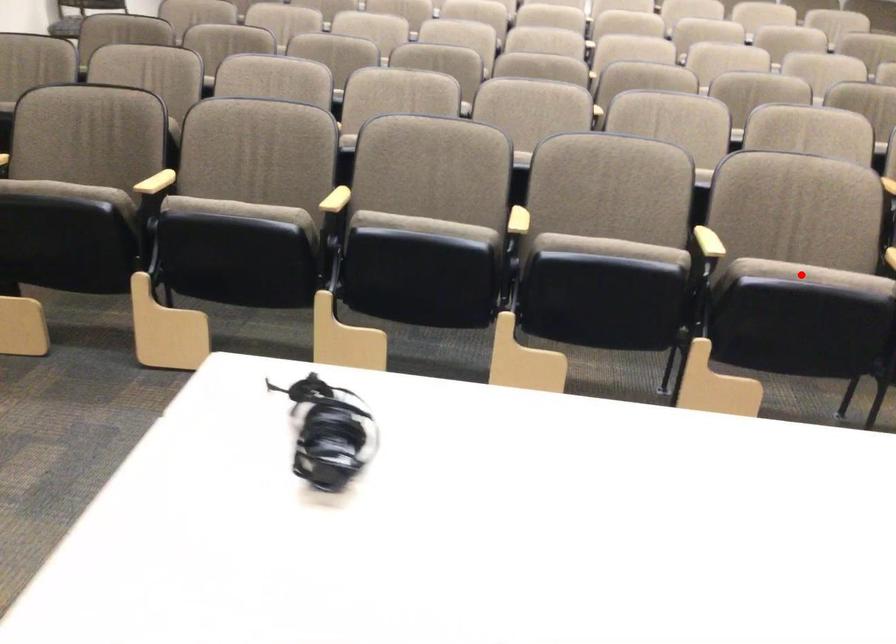
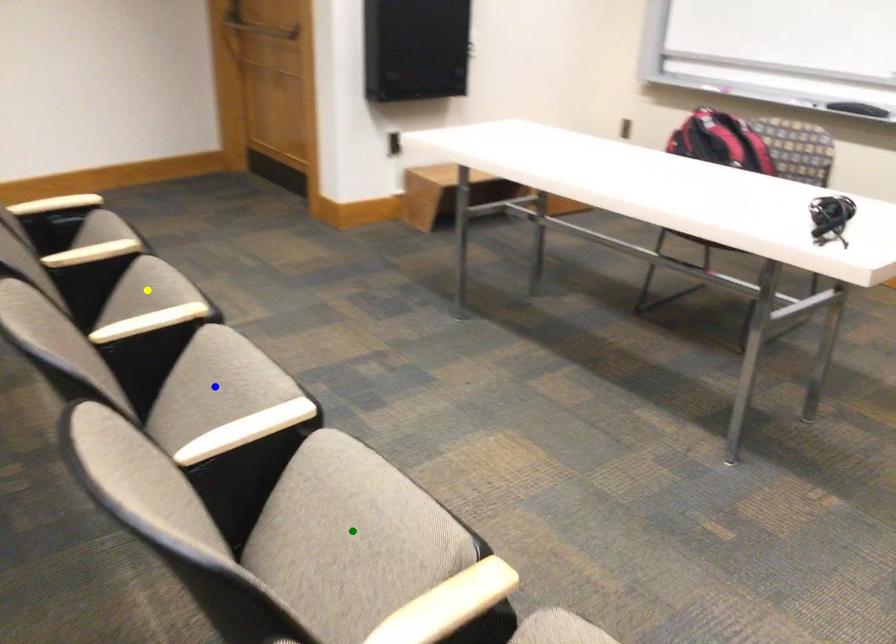
Question: I am providing you with two images of the same scene from different viewpoints. A red point is marked on the first image. You are given multiple points on the second image. Which mark in image 2 goes with the point in image 1?

Choices:
 (A) blue point
 (B) yellow point
 (C) green point

Answer: (B)